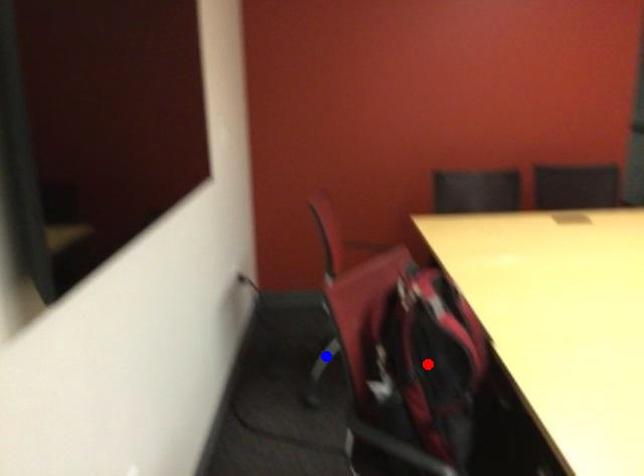
Question: In the image, two points are highlighted. Which point is nearer to the camera? Reply with the corresponding letter.

Choices:
 (A) blue point
 (B) red point

Answer: (B)